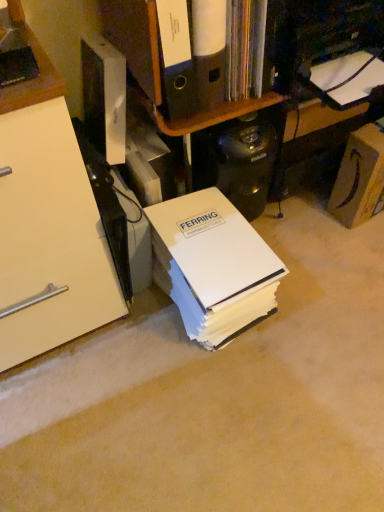
Question: Is matte brown cardboard box at right at the back of white paper at center?

Choices:
 (A) no
 (B) yes

Answer: (A)

Question: Is white paper at center not within matte brown cardboard box at right?

Choices:
 (A) yes
 (B) no

Answer: (A)

Question: Does white paper at center have a greater width compared to matte brown cardboard box at right?

Choices:
 (A) no
 (B) yes

Answer: (B)

Question: From a real-world perspective, is white paper at center beneath matte brown cardboard box at right?

Choices:
 (A) no
 (B) yes

Answer: (B)

Question: Are white paper at center and matte brown cardboard box at right making contact?

Choices:
 (A) yes
 (B) no

Answer: (B)

Question: From the image's perspective, would you say white paper at center is shown under matte brown cardboard box at right?

Choices:
 (A) no
 (B) yes

Answer: (B)

Question: Is matte black coffee maker at upper right bigger than black plastic computer tower at center?

Choices:
 (A) no
 (B) yes

Answer: (B)

Question: Is matte black coffee maker at upper right facing away from black plastic computer tower at center?

Choices:
 (A) no
 (B) yes

Answer: (A)

Question: Can you confirm if matte black coffee maker at upper right is shorter than black plastic computer tower at center?

Choices:
 (A) no
 (B) yes

Answer: (B)

Question: Could you tell me if matte black coffee maker at upper right is turned towards black plastic computer tower at center?

Choices:
 (A) no
 (B) yes

Answer: (A)

Question: Is matte black coffee maker at upper right not inside black plastic computer tower at center?

Choices:
 (A) yes
 (B) no

Answer: (A)

Question: Does matte black coffee maker at upper right have a greater width compared to black plastic computer tower at center?

Choices:
 (A) yes
 (B) no

Answer: (A)

Question: Is white cardboard shelf at upper center bigger than white paper at center?

Choices:
 (A) yes
 (B) no

Answer: (B)